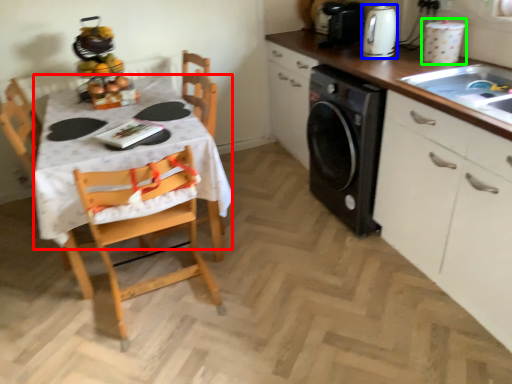
Question: Based on their relative distances, which object is farther from tablecloth (highlighted by a red box)? Choose from kitchen appliance (highlighted by a blue box) and appliance (highlighted by a green box).

Choices:
 (A) kitchen appliance
 (B) appliance

Answer: (B)